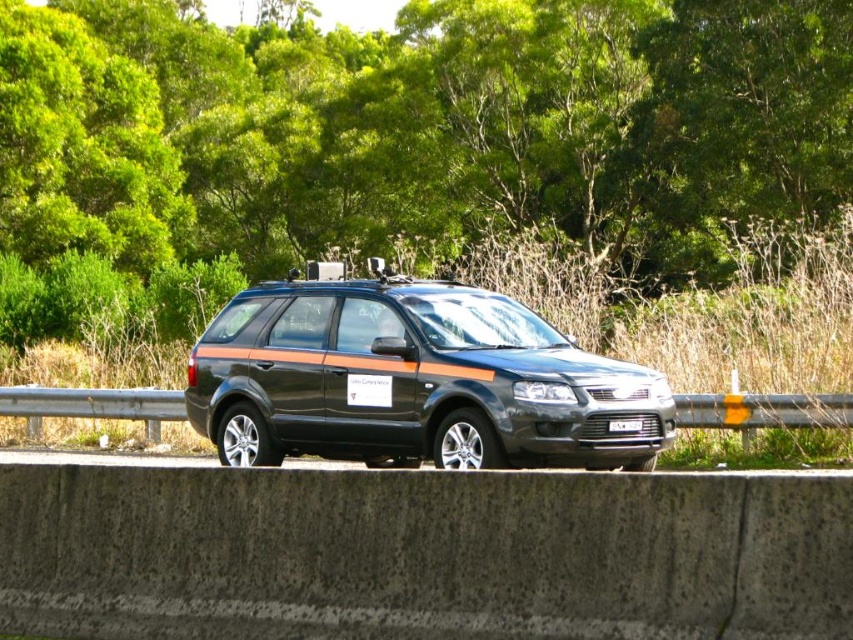
Which is behind, point (706, 218) or point (347, 416)?

The point (706, 218) is more distant.

Is point (378, 179) positioned behind point (224, 413)?

Yes, it is.

Identify the location of green leafy tree at center. This screenshot has width=853, height=640. (421, 129).

This screenshot has width=853, height=640. Identify the location of green leafy tree at center. (421, 129).

Which is above, matte black minivan at center or black plastic license plate at center?

matte black minivan at center is above.

Can you confirm if matte black minivan at center is taller than black plastic license plate at center?

Yes.

Which is in front, point (483, 384) or point (637, 420)?

Point (483, 384)

This screenshot has width=853, height=640. I want to click on matte black minivan at center, so click(413, 380).

Does concrete at center appear under black plastic license plate at center?

Yes.

What do you see at coordinates (422, 554) in the screenshot?
I see `concrete at center` at bounding box center [422, 554].

What do you see at coordinates (422, 554) in the screenshot? This screenshot has width=853, height=640. I see `concrete at center` at bounding box center [422, 554].

You are a GUI agent. You are given a task and a screenshot of the screen. Output one action in this format:
    pyautogui.click(x=<x>, y=<y>)
    Task: Click on the concrete at center
    
    Given the screenshot: What is the action you would take?
    pyautogui.click(x=422, y=554)